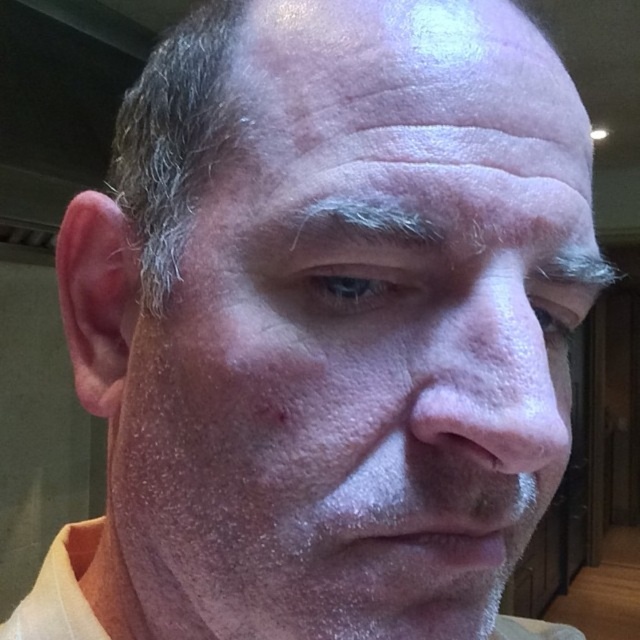
Question: Which point appears farthest from the camera in this image?

Choices:
 (A) (570, 141)
 (B) (528, 360)

Answer: (A)

Question: Which point is closer to the camera?

Choices:
 (A) (467, 109)
 (B) (65, 612)
 (C) (557, 355)

Answer: (A)

Question: Can you confirm if smooth skin nose at center is positioned to the right of yellow cotton shirt at lower center?

Choices:
 (A) no
 (B) yes

Answer: (B)

Question: Can you confirm if smooth skin nose at center is positioned above yellow cotton shirt at lower center?

Choices:
 (A) no
 (B) yes

Answer: (B)

Question: Among these objects, which one is farthest from the camera?

Choices:
 (A) smooth skin nose at center
 (B) smooth skin at upper center
 (C) yellow cotton shirt at lower center

Answer: (C)

Question: Is smooth skin at upper center thinner than smooth skin nose at center?

Choices:
 (A) no
 (B) yes

Answer: (A)